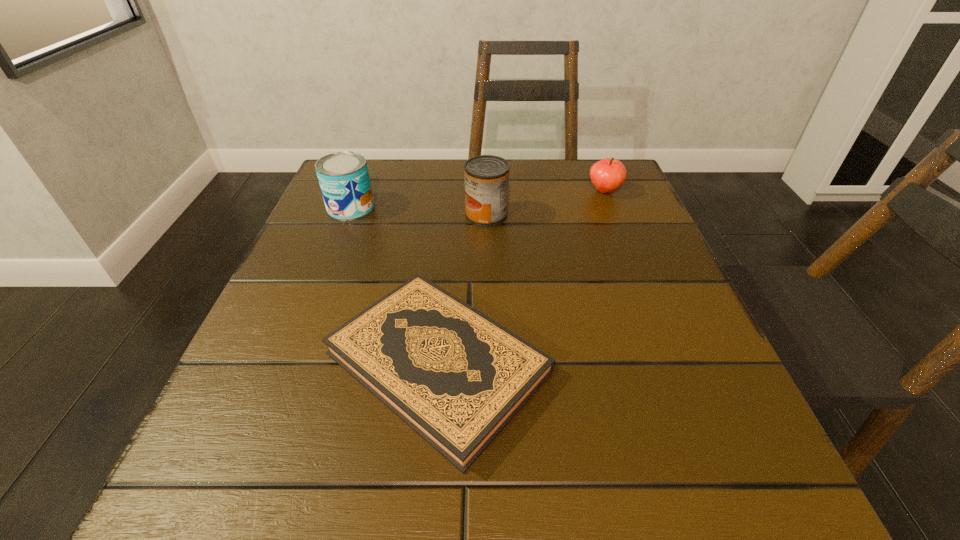
You are a GUI agent. You are given a task and a screenshot of the screen. Output one action in this format:
    pyautogui.click(x=<x>, y=<y>)
    Task: Click on the apple that is at the far edge
    Image resolution: width=960 pixels, height=540 pixels.
    Given the screenshot: What is the action you would take?
    (x=607, y=175)

Where is `object that is at the near edge`? This screenshot has width=960, height=540. object that is at the near edge is located at coordinates (455, 376).

Where is `can at the left edge`? Image resolution: width=960 pixels, height=540 pixels. can at the left edge is located at coordinates (343, 176).

I want to click on hardback book that is at the left edge, so click(455, 376).

Where is `object that is at the right edge`? The height and width of the screenshot is (540, 960). object that is at the right edge is located at coordinates (607, 175).

Where is `object that is at the far left corner`? The width and height of the screenshot is (960, 540). object that is at the far left corner is located at coordinates (343, 176).

Where is `object located at the near left corner`? object located at the near left corner is located at coordinates (455, 376).

This screenshot has height=540, width=960. In order to click on object present at the far right corner in this screenshot , I will do `click(607, 175)`.

You are a GUI agent. You are given a task and a screenshot of the screen. Output one action in this format:
    pyautogui.click(x=<x>, y=<y>)
    Task: Click on the free space at the far edge
    This screenshot has width=960, height=540.
    Given the screenshot: What is the action you would take?
    pyautogui.click(x=428, y=194)

At what (x,y) coordinates should I click in order to perform the action: click on vacant space at the right edge of the desktop. Please return your answer as a coordinate pair (x, y). The height and width of the screenshot is (540, 960). Looking at the image, I should click on tap(726, 415).